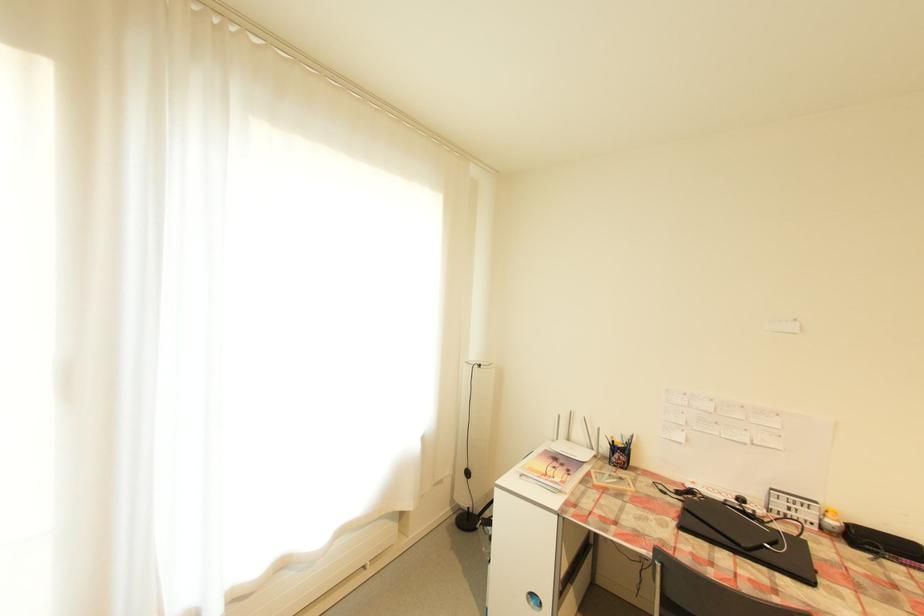
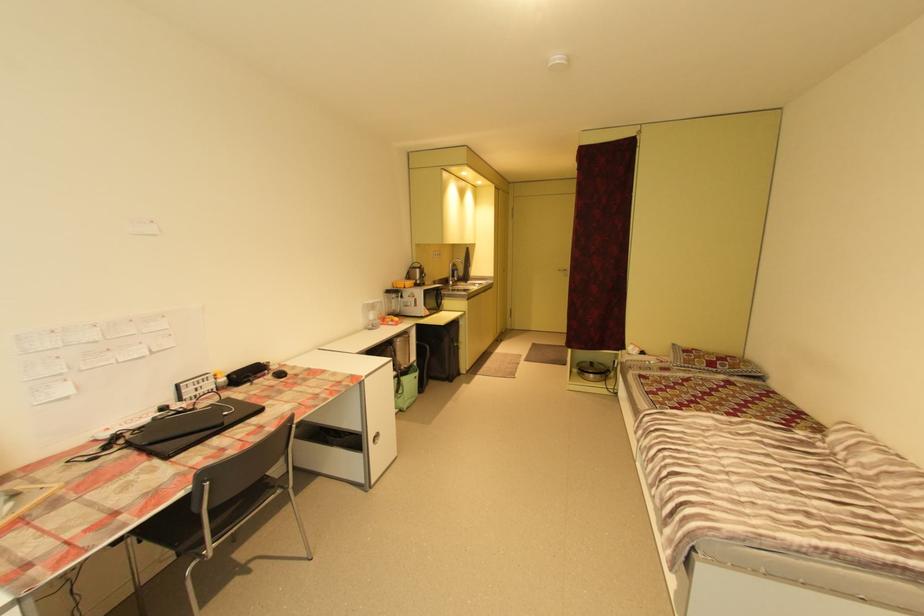
Question: The camera is either moving clockwise (left) or counter-clockwise (right) around the object. The first image is from the beginning of the video and the second image is from the end. Is the camera moving left or right when shooting the video?

Choices:
 (A) Left
 (B) Right

Answer: (A)